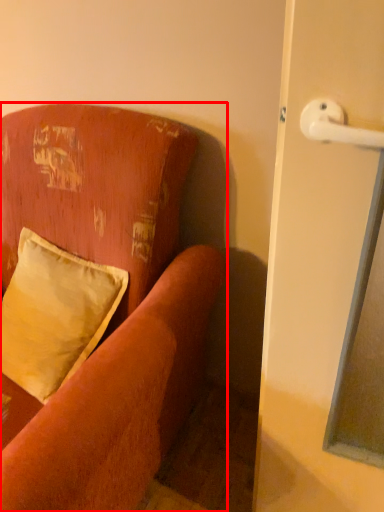
Question: From the image, what is the correct spatial relationship of studio couch (annotated by the red box) in relation to pillow?

Choices:
 (A) right
 (B) left

Answer: (B)